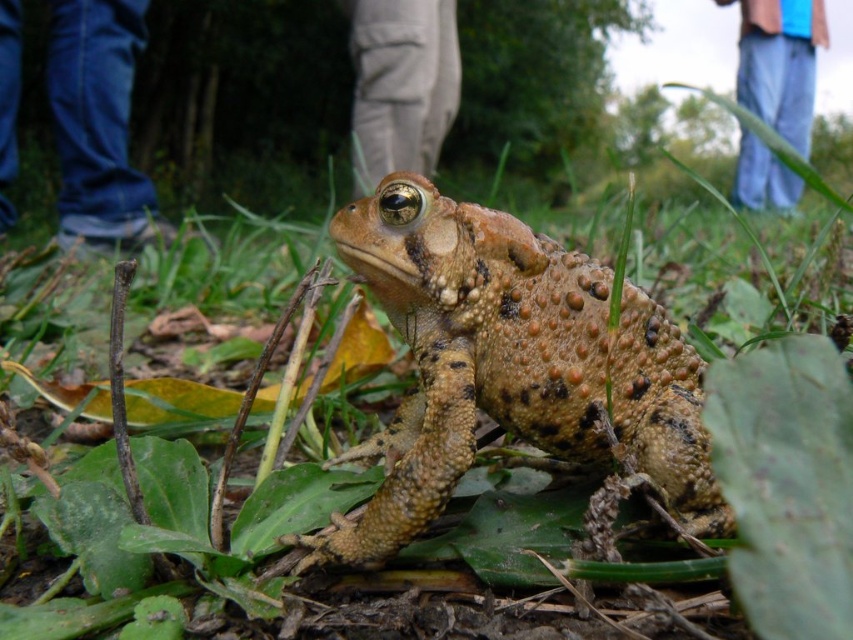
You are a photographer trying to capture both the blue denim jeans at lower left and the khaki cotton pants at center in a single frame. Based on their positions, which object should you adjust your camera angle to focus on first to ensure both are in the frame?

The blue denim jeans at lower left is to the left of khaki cotton pants at center, so you should adjust your camera angle to focus on the blue denim jeans at lower left first to ensure both are included in the frame.

You are a photographer trying to capture a close shot of the toad. You notice khaki cotton pants at center and blue jeans at upper right in your frame. Which piece of clothing should you avoid moving closer to the toad to prevent disturbing it?

You should avoid moving closer to the khaki cotton pants at center because it is larger in size than the blue jeans at upper right and might be closer to the toad, causing more disturbance.